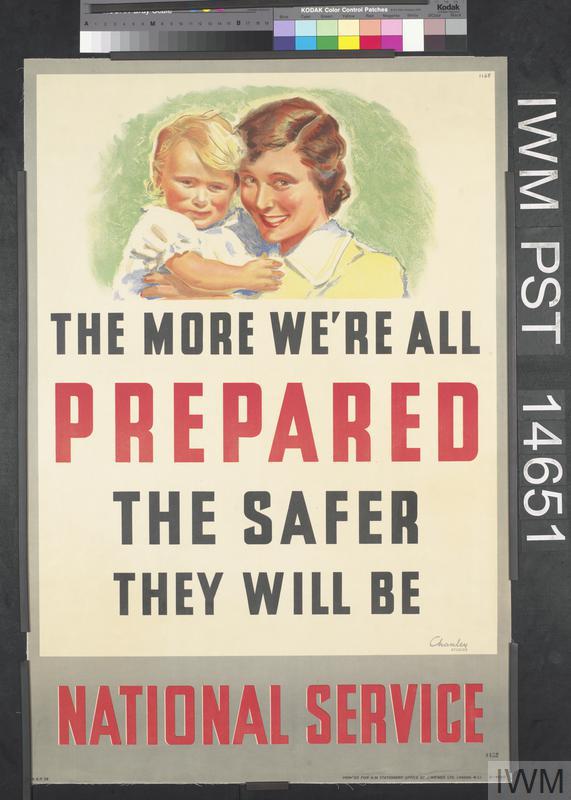
The image size is (571, 800). What are the coordinates of `color palette` in the screenshot? It's located at (283, 22).